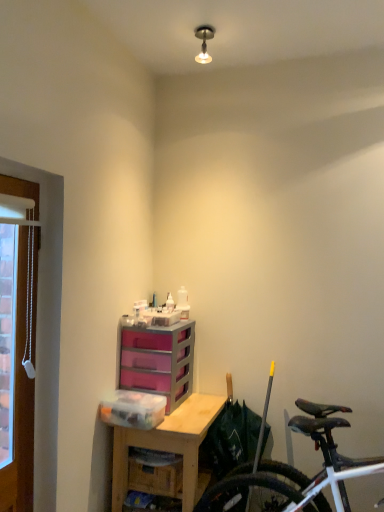
Question: Is clear plastic container at lower center positioned behind wooden desk at center?

Choices:
 (A) no
 (B) yes

Answer: (B)

Question: Is clear plastic container at lower center next to wooden desk at center?

Choices:
 (A) no
 (B) yes

Answer: (A)

Question: Does clear plastic container at lower center have a greater height compared to wooden desk at center?

Choices:
 (A) yes
 (B) no

Answer: (B)

Question: Considering the relative sizes of clear plastic container at lower center and wooden desk at center in the image provided, is clear plastic container at lower center smaller than wooden desk at center?

Choices:
 (A) yes
 (B) no

Answer: (A)

Question: Could you tell me if clear plastic container at lower center is turned towards wooden desk at center?

Choices:
 (A) no
 (B) yes

Answer: (A)

Question: Considering the positions of brown wooden door at left and white matte bicycle at lower right in the image, is brown wooden door at left taller or shorter than white matte bicycle at lower right?

Choices:
 (A) short
 (B) tall

Answer: (B)

Question: Based on their positions, is brown wooden door at left located to the left or right of white matte bicycle at lower right?

Choices:
 (A) left
 (B) right

Answer: (A)

Question: Does point (23, 314) appear closer or farther from the camera than point (286, 477)?

Choices:
 (A) closer
 (B) farther

Answer: (A)

Question: Relative to white matte bicycle at lower right, is brown wooden door at left in front or behind?

Choices:
 (A) behind
 (B) front

Answer: (B)

Question: Considering the positions of clear plastic container at lower center and white matte bicycle at lower right in the image, is clear plastic container at lower center taller or shorter than white matte bicycle at lower right?

Choices:
 (A) tall
 (B) short

Answer: (B)

Question: Is point (125, 390) closer or farther from the camera than point (332, 425)?

Choices:
 (A) closer
 (B) farther

Answer: (B)

Question: From a real-world perspective, relative to white matte bicycle at lower right, is clear plastic container at lower center vertically above or below?

Choices:
 (A) below
 (B) above

Answer: (B)

Question: From the image's perspective, is clear plastic container at lower center above or below white matte bicycle at lower right?

Choices:
 (A) below
 (B) above

Answer: (B)

Question: Is metallic ceiling light at upper center bigger or smaller than wooden desk at center?

Choices:
 (A) big
 (B) small

Answer: (B)

Question: Considering the positions of point (198, 37) and point (175, 449), is point (198, 37) closer or farther from the camera than point (175, 449)?

Choices:
 (A) closer
 (B) farther

Answer: (B)